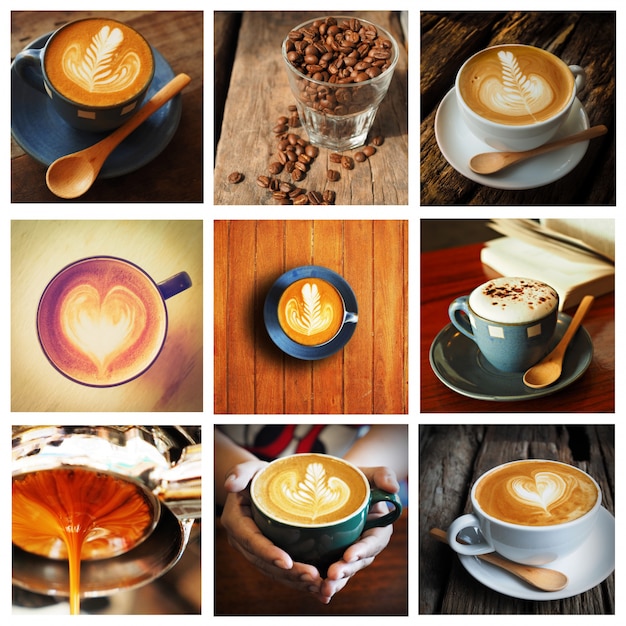
Locate an element on the screen. The image size is (626, 626). ceramic mug is located at coordinates (95, 116), (508, 135), (180, 280), (349, 317), (501, 342), (327, 535), (525, 546).